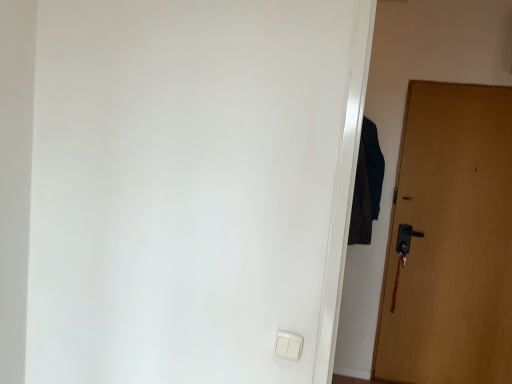
Question: Considering the relative sizes of dark blue fabric at right and wooden door at right in the image provided, is dark blue fabric at right thinner than wooden door at right?

Choices:
 (A) no
 (B) yes

Answer: (A)

Question: From a real-world perspective, does dark blue fabric at right sit lower than wooden door at right?

Choices:
 (A) no
 (B) yes

Answer: (A)

Question: Could wooden door at right be considered to be inside dark blue fabric at right?

Choices:
 (A) yes
 (B) no

Answer: (B)

Question: Is dark blue fabric at right looking in the opposite direction of wooden door at right?

Choices:
 (A) yes
 (B) no

Answer: (B)

Question: Does dark blue fabric at right have a lesser height compared to wooden door at right?

Choices:
 (A) yes
 (B) no

Answer: (A)

Question: From a real-world perspective, is white plastic light switch at lower center positioned above or below wooden door at right?

Choices:
 (A) above
 (B) below

Answer: (B)

Question: In terms of height, does white plastic light switch at lower center look taller or shorter compared to wooden door at right?

Choices:
 (A) tall
 (B) short

Answer: (B)

Question: Relative to wooden door at right, is white plastic light switch at lower center in front or behind?

Choices:
 (A) front
 (B) behind

Answer: (A)

Question: Is point (293, 339) closer or farther from the camera than point (375, 365)?

Choices:
 (A) closer
 (B) farther

Answer: (A)

Question: In terms of width, does white plastic light switch at lower center look wider or thinner when compared to dark blue fabric at right?

Choices:
 (A) wide
 (B) thin

Answer: (B)

Question: Relative to dark blue fabric at right, is white plastic light switch at lower center in front or behind?

Choices:
 (A) front
 (B) behind

Answer: (A)

Question: Considering the positions of white plastic light switch at lower center and dark blue fabric at right in the image, is white plastic light switch at lower center taller or shorter than dark blue fabric at right?

Choices:
 (A) short
 (B) tall

Answer: (A)

Question: Based on their sizes in the image, would you say white plastic light switch at lower center is bigger or smaller than dark blue fabric at right?

Choices:
 (A) small
 (B) big

Answer: (A)

Question: Is wooden door at right wider or thinner than dark blue fabric at right?

Choices:
 (A) thin
 (B) wide

Answer: (A)

Question: Is point (501, 206) closer or farther from the camera than point (375, 205)?

Choices:
 (A) farther
 (B) closer

Answer: (B)